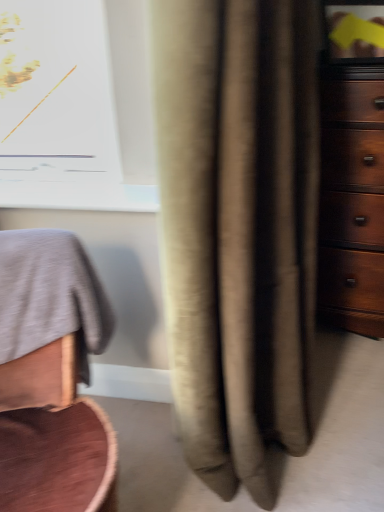
Measure the distance between dark wood dresser at right and camera.

The distance of dark wood dresser at right from camera is 1.40 meters.

Describe the element at coordinates (238, 226) in the screenshot. I see `beige fabric curtain at center` at that location.

Measure the distance between point (201, 79) and camera.

The depth of point (201, 79) is 70.90 centimeters.

I want to click on smooth gray fabric at left, so click(51, 377).

Is beige fabric curtain at center smaller than dark wood dresser at right?

No.

Is beige fabric curtain at center to the left of dark wood dresser at right from the viewer's perspective?

Correct, you'll find beige fabric curtain at center to the left of dark wood dresser at right.

From a real-world perspective, which is physically below, beige fabric curtain at center or dark wood dresser at right?

dark wood dresser at right, from a real-world perspective.

What's the angular difference between beige fabric curtain at center and dark wood dresser at right's facing directions?

The angle between the facing direction of beige fabric curtain at center and the facing direction of dark wood dresser at right is 90.4 degrees.

From a real-world perspective, is smooth gray fabric at left below beige fabric curtain at center?

Yes, from a real-world perspective, smooth gray fabric at left is beneath beige fabric curtain at center.

From the image's perspective, is smooth gray fabric at left positioned above or below beige fabric curtain at center?

Clearly, from the image's perspective, smooth gray fabric at left is below beige fabric curtain at center.

Is smooth gray fabric at left turned away from beige fabric curtain at center?

smooth gray fabric at left does not have its back to beige fabric curtain at center.

Considering the sizes of objects dark wood dresser at right and smooth gray fabric at left in the image provided, who is wider, dark wood dresser at right or smooth gray fabric at left?

smooth gray fabric at left.

Is dark wood dresser at right facing away from smooth gray fabric at left?

No, dark wood dresser at right's orientation is not away from smooth gray fabric at left.

Does dark wood dresser at right have a greater height compared to smooth gray fabric at left?

Indeed, dark wood dresser at right has a greater height compared to smooth gray fabric at left.

In the scene shown: Visually, is dark wood dresser at right positioned to the left or to the right of smooth gray fabric at left?

In the image, dark wood dresser at right appears on the right side of smooth gray fabric at left.

In the scene shown: From the image's perspective, relative to smooth gray fabric at left, is beige fabric curtain at center above or below?

From the image's perspective, beige fabric curtain at center appears above smooth gray fabric at left.

Which of these two, beige fabric curtain at center or smooth gray fabric at left, is smaller?

Smaller between the two is smooth gray fabric at left.

From a real-world perspective, is beige fabric curtain at center positioned above or below smooth gray fabric at left?

In terms of real-world spatial position, beige fabric curtain at center is above smooth gray fabric at left.

Considering the relative sizes of beige fabric curtain at center and smooth gray fabric at left in the image provided, is beige fabric curtain at center wider than smooth gray fabric at left?

No.

Consider the image. Is smooth gray fabric at left oriented away from dark wood dresser at right?

No.

Consider the image. Considering the relative positions of smooth gray fabric at left and dark wood dresser at right in the image provided, is smooth gray fabric at left to the left or to the right of dark wood dresser at right?

smooth gray fabric at left is to the left of dark wood dresser at right.

Looking at this image, in terms of size, does smooth gray fabric at left appear bigger or smaller than dark wood dresser at right?

smooth gray fabric at left is smaller than dark wood dresser at right.

Which is further, (41, 474) or (323, 223)?

Positioned behind is point (323, 223).

Does dark wood dresser at right have a smaller size compared to beige fabric curtain at center?

Correct, dark wood dresser at right occupies less space than beige fabric curtain at center.

Which is in front, dark wood dresser at right or beige fabric curtain at center?

beige fabric curtain at center is in front.

From the image's perspective, is dark wood dresser at right above beige fabric curtain at center?

Indeed, from the image's perspective, dark wood dresser at right is shown above beige fabric curtain at center.

What's the angular difference between dark wood dresser at right and beige fabric curtain at center's facing directions?

90.4 degrees separate the facing orientations of dark wood dresser at right and beige fabric curtain at center.

Identify the location of the chest of drawers that appears behind the beige fabric curtain at center. This screenshot has width=384, height=512. (352, 167).

Locate an element on the screen. The image size is (384, 512). furniture on the left of the beige fabric curtain at center is located at coordinates (51, 377).

Estimate the real-world distances between objects in this image. Which object is further from dark wood dresser at right, smooth gray fabric at left or beige fabric curtain at center?

The object further to dark wood dresser at right is smooth gray fabric at left.

When comparing their distances from beige fabric curtain at center, does smooth gray fabric at left or dark wood dresser at right seem further?

dark wood dresser at right is positioned further to the anchor beige fabric curtain at center.

Consider the image. Looking at the image, which one is located further to smooth gray fabric at left, beige fabric curtain at center or dark wood dresser at right?

Among the two, dark wood dresser at right is located further to smooth gray fabric at left.

Based on their spatial positions, is dark wood dresser at right or smooth gray fabric at left closer to beige fabric curtain at center?

smooth gray fabric at left is closer to beige fabric curtain at center.

From the image, which object appears to be nearer to dark wood dresser at right, beige fabric curtain at center or smooth gray fabric at left?

The object closer to dark wood dresser at right is beige fabric curtain at center.

Looking at the image, which one is located further to smooth gray fabric at left, dark wood dresser at right or beige fabric curtain at center?

Based on the image, dark wood dresser at right appears to be further to smooth gray fabric at left.

Find the location of a particular element. This screenshot has height=512, width=384. curtain between smooth gray fabric at left and dark wood dresser at right is located at coordinates (238, 226).